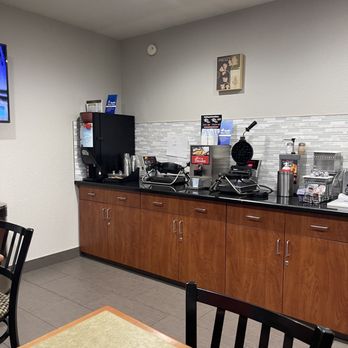
This screenshot has height=348, width=348. I want to click on clock, so 151,50.